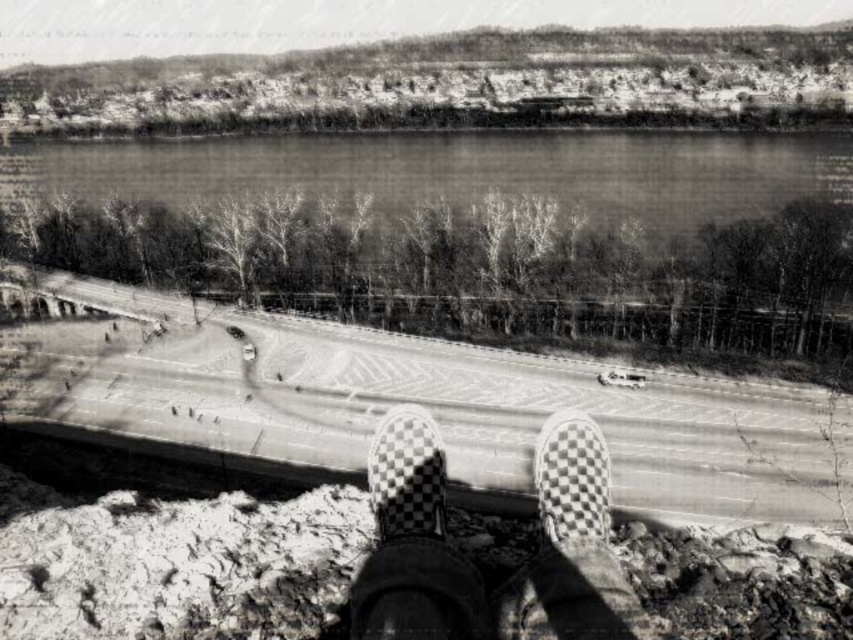
Question: Among these points, which one is farthest from the camera?

Choices:
 (A) (598, 484)
 (B) (444, 454)
 (C) (467, 168)

Answer: (C)

Question: Does checkerboard-patterned sneakers at center appear over checkered fabric shoe at center?

Choices:
 (A) yes
 (B) no

Answer: (A)

Question: Based on their relative distances, which object is nearer to the checkered fabric shoe at center?

Choices:
 (A) checkerboard-patterned sneakers at center
 (B) checkerboard-patterned shoes at center

Answer: (B)

Question: In this image, where is checkerboard-patterned sneakers at center located relative to checkered fabric shoe at center?

Choices:
 (A) right
 (B) left

Answer: (B)

Question: Can you confirm if smooth water at upper center is bigger than checkerboard-patterned shoes at center?

Choices:
 (A) no
 (B) yes

Answer: (B)

Question: Among these objects, which one is nearest to the camera?

Choices:
 (A) smooth water at upper center
 (B) checkerboard-patterned sneakers at center

Answer: (B)